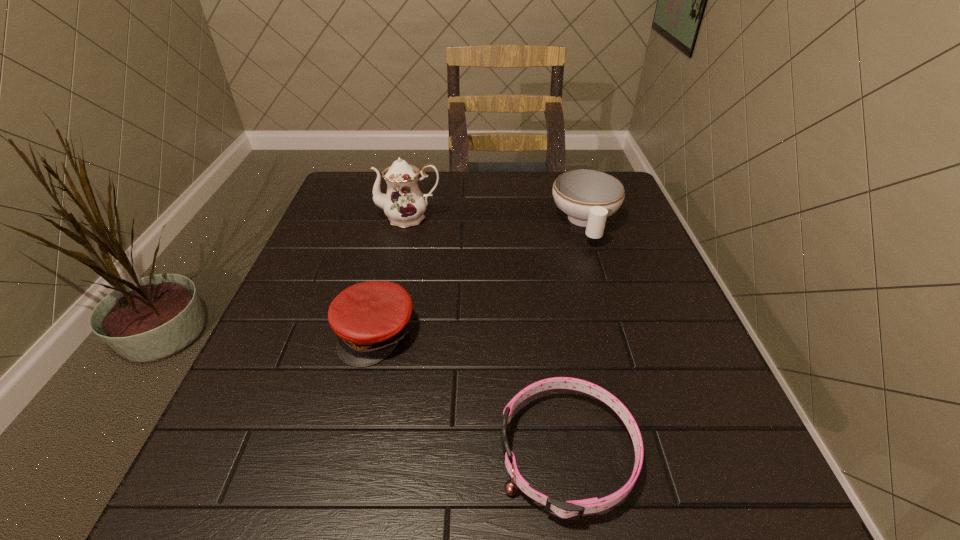
Where is `the left chinaware`? the left chinaware is located at coordinates (404, 204).

Locate an element on the screen. the taller chinaware is located at coordinates (404, 204).

The height and width of the screenshot is (540, 960). I want to click on the right chinaware, so click(x=588, y=197).

At what (x,y) coordinates should I click in order to perform the action: click on the shorter chinaware. Please return your answer as a coordinate pair (x, y). The height and width of the screenshot is (540, 960). Looking at the image, I should click on (588, 197).

You are a GUI agent. You are given a task and a screenshot of the screen. Output one action in this format:
    pyautogui.click(x=<x>, y=<y>)
    Task: Click on the third tallest object
    The image size is (960, 540).
    Given the screenshot: What is the action you would take?
    pyautogui.click(x=370, y=318)

Where is `the third farthest object`? The image size is (960, 540). the third farthest object is located at coordinates [x=370, y=318].

This screenshot has height=540, width=960. What are the coordinates of `the nearest object` in the screenshot? It's located at (570, 510).

Identify the location of dog collar. Image resolution: width=960 pixels, height=540 pixels. (570, 510).

Locate an element on the screen. This screenshot has width=960, height=540. free space located on the left of the left chinaware is located at coordinates (323, 218).

Locate an element on the screen. Image resolution: width=960 pixels, height=540 pixels. free space located on the side with the handle of the third shortest object is located at coordinates (610, 299).